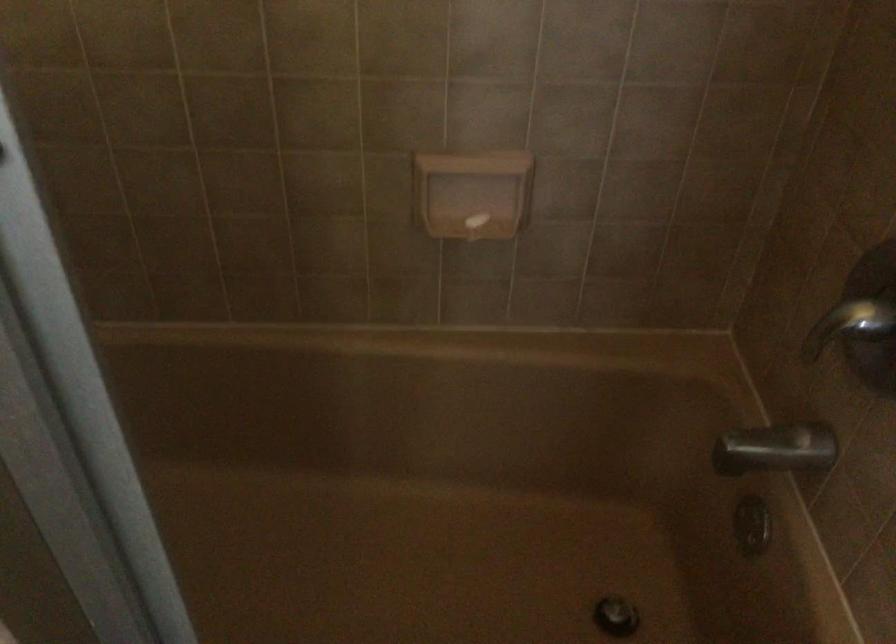
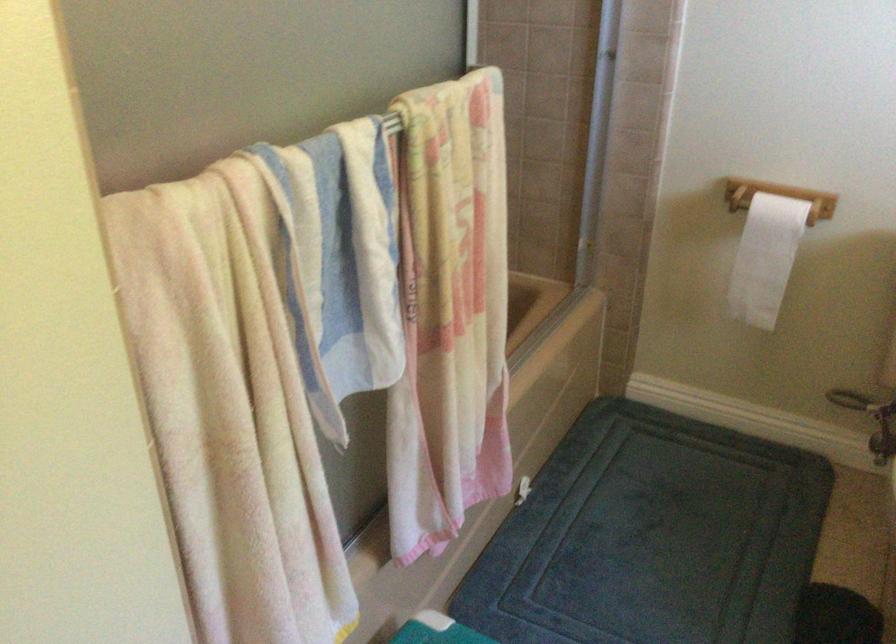
Question: I am providing you with two images of the same scene from different viewpoints. Which of the following objects are not visible in image2?

Choices:
 (A) silver port cover
 (B) faucet diverter knob
 (C) white toilet paper
 (D) metal shower handle

Answer: (B)